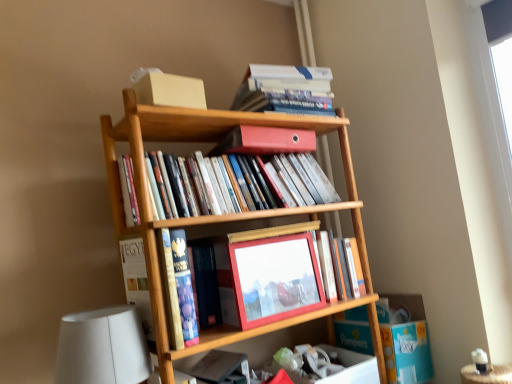
Describe the element at coordinates (178, 288) in the screenshot. I see `hardcover book at center, placed as the fifth book when sorted from top to bottom` at that location.

Describe the element at coordinates (270, 280) in the screenshot. I see `matte red picture frame at center` at that location.

Where is `matte plastic folder at upper center, which appears as the 2th book when viewed from the top`? The height and width of the screenshot is (384, 512). matte plastic folder at upper center, which appears as the 2th book when viewed from the top is located at coordinates (265, 141).

Looking at this image, how much space does matte black book at lower center, which is the first book in bottom-to-top order, occupy horizontally?

The width of matte black book at lower center, which is the first book in bottom-to-top order, is 8.61 inches.

Measure the distance between hardcover book at upper center, which appears as the 1th book when viewed from the top, and camera.

hardcover book at upper center, which appears as the 1th book when viewed from the top, and camera are 4.51 feet apart from each other.

The width and height of the screenshot is (512, 384). I want to click on hardcover book at center, placed as the fifth book when sorted from top to bottom, so click(178, 288).

This screenshot has width=512, height=384. I want to click on the 5th book above when counting from the matte black book at lower center, which is the first book in bottom-to-top order (from the image's perspective), so click(x=285, y=89).

Which of these two, matte black book at lower center, which is the first book in bottom-to-top order, or hardcover book at upper center, which appears as the 1th book when viewed from the top, stands taller?

matte black book at lower center, which is the first book in bottom-to-top order.

Are matte black book at lower center, which is the first book in bottom-to-top order, and hardcover book at upper center, which is counted as the 6th book, starting from the bottom, located far from each other?

No, matte black book at lower center, which is the first book in bottom-to-top order, is not far away from hardcover book at upper center, which is counted as the 6th book, starting from the bottom.

Is matte black book at lower center, which is counted as the 6th book, starting from the top, facing away from hardcover book at upper center, which appears as the 1th book when viewed from the top?

No.

Is matte wooden frame at center, placed as the third book when sorted from bottom to top, aimed at matte plastic folder at upper center, arranged as the fifth book when ordered from the bottom?

No, matte wooden frame at center, placed as the third book when sorted from bottom to top, does not turn towards matte plastic folder at upper center, arranged as the fifth book when ordered from the bottom.

From a real-world perspective, does matte wooden frame at center, placed as the third book when sorted from bottom to top, sit lower than matte plastic folder at upper center, which appears as the 2th book when viewed from the top?

Yes, from a real-world perspective, matte wooden frame at center, placed as the third book when sorted from bottom to top, is beneath matte plastic folder at upper center, which appears as the 2th book when viewed from the top.

Looking at this image, does matte wooden frame at center, which appears as the fourth book when viewed from the top, appear on the right side of matte plastic folder at upper center, which appears as the 2th book when viewed from the top?

Correct, you'll find matte wooden frame at center, which appears as the fourth book when viewed from the top, to the right of matte plastic folder at upper center, which appears as the 2th book when viewed from the top.

Does point (191, 313) appear closer or farther from the camera than point (287, 255)?

Clearly, point (191, 313) is closer to the camera than point (287, 255).

Is hardcover book at center, acting as the second book starting from the bottom, not within matte red picture frame at center?

Yes, hardcover book at center, acting as the second book starting from the bottom, is not within matte red picture frame at center.

Which object is further away from the camera, hardcover book at center, acting as the second book starting from the bottom, or matte red picture frame at center?

hardcover book at center, acting as the second book starting from the bottom, is more distant.

At what (x,y) coordinates should I click in order to perform the action: click on picture frame that appears on the right of hardcover book at center, acting as the second book starting from the bottom. Please return your answer as a coordinate pair (x, y). Looking at the image, I should click on pyautogui.click(x=270, y=280).

Relative to hardcover book at upper center, which appears as the 1th book when viewed from the top, is matte plastic binder at center, which appears as the fourth book when ordered from the bottom, in front or behind?

matte plastic binder at center, which appears as the fourth book when ordered from the bottom, is in front of hardcover book at upper center, which appears as the 1th book when viewed from the top.

Consider the image. Does matte plastic binder at center, the third book when ordered from top to bottom, have a greater width compared to hardcover book at upper center, which is counted as the 6th book, starting from the bottom?

No.

Is matte plastic binder at center, the third book when ordered from top to bottom, facing towards hardcover book at upper center, which appears as the 1th book when viewed from the top?

No.

From the picture: Is matte plastic binder at center, the third book when ordered from top to bottom, placed right next to hardcover book at upper center, which appears as the 1th book when viewed from the top?

No, matte plastic binder at center, the third book when ordered from top to bottom, is not touching hardcover book at upper center, which appears as the 1th book when viewed from the top.

From a real-world perspective, is white matte table lamp at lower left on top of matte plastic binder at center, which appears as the fourth book when ordered from the bottom?

No.

Which is behind, white matte table lamp at lower left or matte plastic binder at center, the third book when ordered from top to bottom?

matte plastic binder at center, the third book when ordered from top to bottom, is behind.

From the image's perspective, relative to matte plastic binder at center, the third book when ordered from top to bottom, is white matte table lamp at lower left above or below?

Based on their image positions, white matte table lamp at lower left is located beneath matte plastic binder at center, the third book when ordered from top to bottom.

Which is more to the right, white matte table lamp at lower left or matte plastic binder at center, the third book when ordered from top to bottom?

matte plastic binder at center, the third book when ordered from top to bottom.

I want to click on picture frame that appears on the right of matte black book at lower center, which is counted as the 6th book, starting from the top, so click(270, 280).

Considering the relative sizes of matte black book at lower center, which is the first book in bottom-to-top order, and matte red picture frame at center in the image provided, is matte black book at lower center, which is the first book in bottom-to-top order, thinner than matte red picture frame at center?

Incorrect, the width of matte black book at lower center, which is the first book in bottom-to-top order, is not less than that of matte red picture frame at center.

Could matte red picture frame at center be considered to be inside matte black book at lower center, which is the first book in bottom-to-top order?

That's incorrect, matte red picture frame at center is not inside matte black book at lower center, which is the first book in bottom-to-top order.

Based on the photo, is matte black book at lower center, which is the first book in bottom-to-top order, looking in the opposite direction of matte red picture frame at center?

No, matte black book at lower center, which is the first book in bottom-to-top order, is not facing away from matte red picture frame at center.

Does matte black book at lower center, which is counted as the 6th book, starting from the top, have a greater height compared to matte plastic folder at upper center, which appears as the 2th book when viewed from the top?

Yes.

Does matte black book at lower center, which is counted as the 6th book, starting from the top, come in front of matte plastic folder at upper center, which appears as the 2th book when viewed from the top?

That is True.

There is a matte plastic folder at upper center, which appears as the 2th book when viewed from the top. Where is `the 4th book below it (from a real-world perspective)`? The height and width of the screenshot is (384, 512). the 4th book below it (from a real-world perspective) is located at coordinates (217, 365).

From the hardcover book at upper center, which is counted as the 6th book, starting from the bottom, count 3rd books forward and point to it. Please provide its 2D coordinates.

[(217, 365)]

Where is `book that is the 1st one when counting backward from the matte plastic folder at upper center, arranged as the fifth book when ordered from the bottom`? The height and width of the screenshot is (384, 512). book that is the 1st one when counting backward from the matte plastic folder at upper center, arranged as the fifth book when ordered from the bottom is located at coordinates click(x=342, y=266).

From the image, which object appears to be farther from hardcover book at center, placed as the fifth book when sorted from top to bottom, matte plastic binder at center, the third book when ordered from top to bottom, or matte red picture frame at center?

Among the two, matte plastic binder at center, the third book when ordered from top to bottom, is located further to hardcover book at center, placed as the fifth book when sorted from top to bottom.

Which object lies nearer to the anchor point white matte table lamp at lower left, matte red picture frame at center or hardcover book at upper center, which appears as the 1th book when viewed from the top?

matte red picture frame at center.

Based on their spatial positions, is hardcover book at center, acting as the second book starting from the bottom, or hardcover book at upper center, which appears as the 1th book when viewed from the top, further from matte plastic folder at upper center, which appears as the 2th book when viewed from the top?

Among the two, hardcover book at center, acting as the second book starting from the bottom, is located further to matte plastic folder at upper center, which appears as the 2th book when viewed from the top.

When comparing their distances from matte plastic folder at upper center, which appears as the 2th book when viewed from the top, does hardcover book at center, placed as the fifth book when sorted from top to bottom, or matte plastic binder at center, the third book when ordered from top to bottom, seem further?

The object further to matte plastic folder at upper center, which appears as the 2th book when viewed from the top, is hardcover book at center, placed as the fifth book when sorted from top to bottom.

From the image, which object appears to be nearer to matte plastic folder at upper center, arranged as the fifth book when ordered from the bottom, hardcover book at center, acting as the second book starting from the bottom, or matte black book at lower center, which is the first book in bottom-to-top order?

hardcover book at center, acting as the second book starting from the bottom.

Based on their spatial positions, is hardcover book at center, placed as the fifth book when sorted from top to bottom, or hardcover book at upper center, which is counted as the 6th book, starting from the bottom, further from matte plastic binder at center, which appears as the fourth book when ordered from the bottom?

The object further to matte plastic binder at center, which appears as the fourth book when ordered from the bottom, is hardcover book at center, placed as the fifth book when sorted from top to bottom.

Estimate the real-world distances between objects in this image. Which object is further from matte red picture frame at center, white matte table lamp at lower left or matte black book at lower center, which is counted as the 6th book, starting from the top?

Based on the image, white matte table lamp at lower left appears to be further to matte red picture frame at center.

Considering their positions, is matte plastic folder at upper center, which appears as the 2th book when viewed from the top, positioned further to hardcover book at upper center, which is counted as the 6th book, starting from the bottom, than matte black book at lower center, which is the first book in bottom-to-top order?

The object further to hardcover book at upper center, which is counted as the 6th book, starting from the bottom, is matte black book at lower center, which is the first book in bottom-to-top order.

Where is `table lamp between matte plastic binder at center, the third book when ordered from top to bottom, and matte black book at lower center, which is counted as the 6th book, starting from the top, vertically`? table lamp between matte plastic binder at center, the third book when ordered from top to bottom, and matte black book at lower center, which is counted as the 6th book, starting from the top, vertically is located at coordinates (102, 348).

Locate an element on the screen. The width and height of the screenshot is (512, 384). picture frame between matte plastic folder at upper center, arranged as the fifth book when ordered from the bottom, and hardcover book at center, acting as the second book starting from the bottom, vertically is located at coordinates (270, 280).

I want to click on picture frame between matte plastic binder at center, which appears as the fourth book when ordered from the bottom, and matte black book at lower center, which is the first book in bottom-to-top order, in the up-down direction, so click(270, 280).

Identify the location of picture frame between matte plastic binder at center, which appears as the fourth book when ordered from the bottom, and hardcover book at center, acting as the second book starting from the bottom, in the vertical direction. (270, 280).